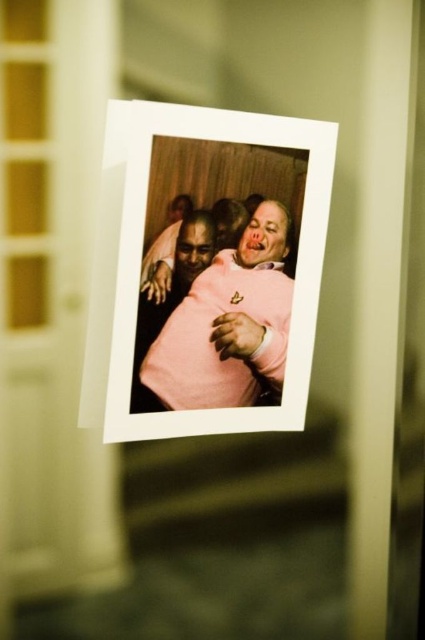
You are organizing a photo album and notice the white paper at center and the pink matte sweater at center in the image. Which object is covering the other one?

The white paper at center is positioned over the pink matte sweater at center, so it is covering it.

You are organizing a photo album and notice the white paper at center and pink matte sweater at center in the image. Which object is positioned to the right when looking at the photo?

The pink matte sweater at center is positioned to the right of the white paper at center.

You are looking at the photograph on the refrigerator. There are two points marked in the image at coordinates point [133,368] and point [229,387]. Which of these two points is closer to you?

Point [133,368] is closer to the viewer than point [229,387].